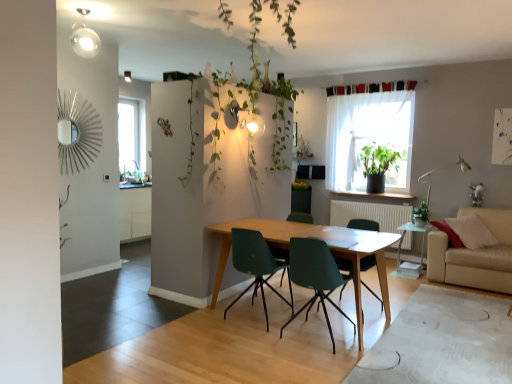
Question: In which direction should I rotate to look at matte green plastic chair at center, which is the fourth chair from right to left?

Choices:
 (A) right
 (B) left

Answer: (A)

Question: Is green matte plant at window turned away from green leafy plant at right?

Choices:
 (A) no
 (B) yes

Answer: (A)

Question: Can you confirm if green matte plant at window is thinner than green leafy plant at right?

Choices:
 (A) yes
 (B) no

Answer: (B)

Question: Can you confirm if green matte plant at window is taller than green leafy plant at right?

Choices:
 (A) yes
 (B) no

Answer: (A)

Question: Is green matte plant at window further to camera compared to green leafy plant at right?

Choices:
 (A) yes
 (B) no

Answer: (A)

Question: Is green matte plant at window at the right side of green leafy plant at right?

Choices:
 (A) yes
 (B) no

Answer: (B)

Question: From a real-world perspective, is green matte plant at window below green leafy plant at right?

Choices:
 (A) no
 (B) yes

Answer: (A)

Question: Is transparent glass side table at lower right to the right of transparent glass window at upper left, marked as the first window in a left-to-right arrangement, from the viewer's perspective?

Choices:
 (A) yes
 (B) no

Answer: (A)

Question: From a real-world perspective, is transparent glass side table at lower right positioned under transparent glass window at upper left, positioned as the first window in back-to-front order, based on gravity?

Choices:
 (A) yes
 (B) no

Answer: (A)

Question: Is transparent glass side table at lower right positioned before transparent glass window at upper left, marked as the first window in a left-to-right arrangement?

Choices:
 (A) yes
 (B) no

Answer: (A)

Question: Does transparent glass side table at lower right turn towards transparent glass window at upper left, arranged as the 2th window when viewed from the front?

Choices:
 (A) no
 (B) yes

Answer: (A)

Question: Is transparent glass side table at lower right surrounding transparent glass window at upper left, placed as the second window when sorted from right to left?

Choices:
 (A) no
 (B) yes

Answer: (A)

Question: Considering the relative sizes of transparent glass side table at lower right and transparent glass window at upper left, positioned as the first window in back-to-front order, in the image provided, is transparent glass side table at lower right thinner than transparent glass window at upper left, positioned as the first window in back-to-front order,?

Choices:
 (A) yes
 (B) no

Answer: (B)

Question: Is matte green chair at center, the 2th chair from the left, surrounding teal plastic chair at center, which is the 2th chair from right to left?

Choices:
 (A) no
 (B) yes

Answer: (A)